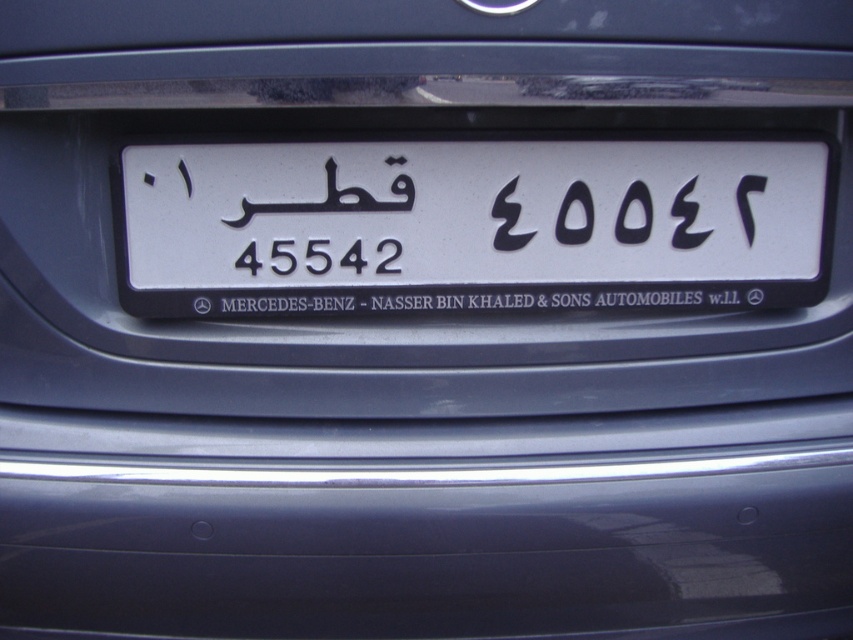
Is black plastic text at center closer to camera compared to black matte number at upper right?

Yes, it is in front of black matte number at upper right.

Between black plastic text at center and black matte number at upper right, which one appears on the right side from the viewer's perspective?

black matte number at upper right

What do you see at coordinates (491, 300) in the screenshot?
I see `black plastic text at center` at bounding box center [491, 300].

Where is `black plastic text at center`? Image resolution: width=853 pixels, height=640 pixels. black plastic text at center is located at coordinates (491, 300).

Looking at this image, is black matte number at center wider than black matte number at upper right?

Indeed, black matte number at center has a greater width compared to black matte number at upper right.

Is black matte number at center closer to camera compared to black matte number at upper right?

Yes.

Find the location of a particular element. black matte number at center is located at coordinates (508, 220).

The image size is (853, 640). In order to click on black matte number at center in this screenshot , I will do `click(508, 220)`.

Is white plastic license plate at center to the right of black plastic text at center from the viewer's perspective?

In fact, white plastic license plate at center is to the left of black plastic text at center.

Who is more distant from viewer, (183, 316) or (683, 285)?

Point (683, 285)

Describe the element at coordinates (468, 227) in the screenshot. This screenshot has height=640, width=853. I see `white plastic license plate at center` at that location.

You are a GUI agent. You are given a task and a screenshot of the screen. Output one action in this format:
    pyautogui.click(x=<x>, y=<y>)
    Task: Click on the white plastic license plate at center
    
    Given the screenshot: What is the action you would take?
    pyautogui.click(x=468, y=227)